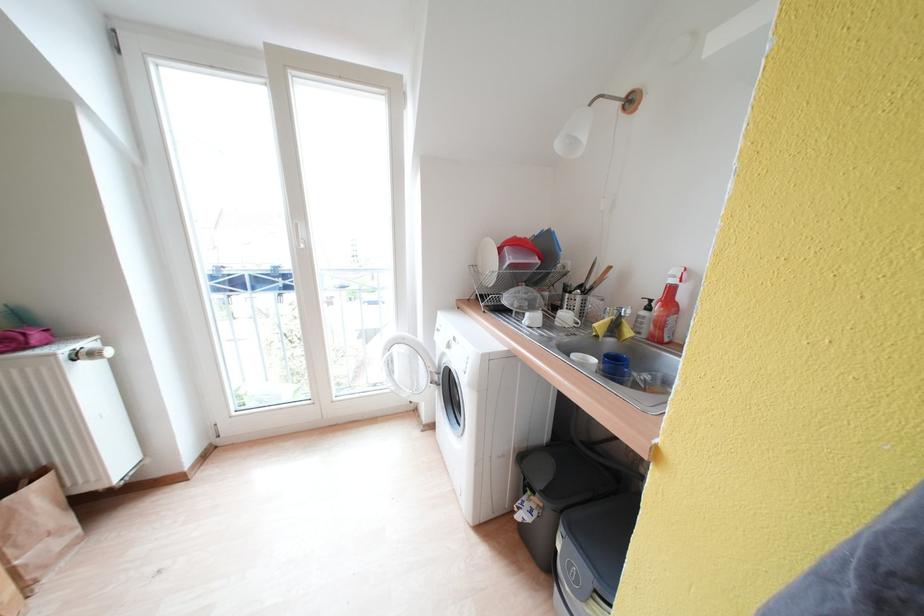
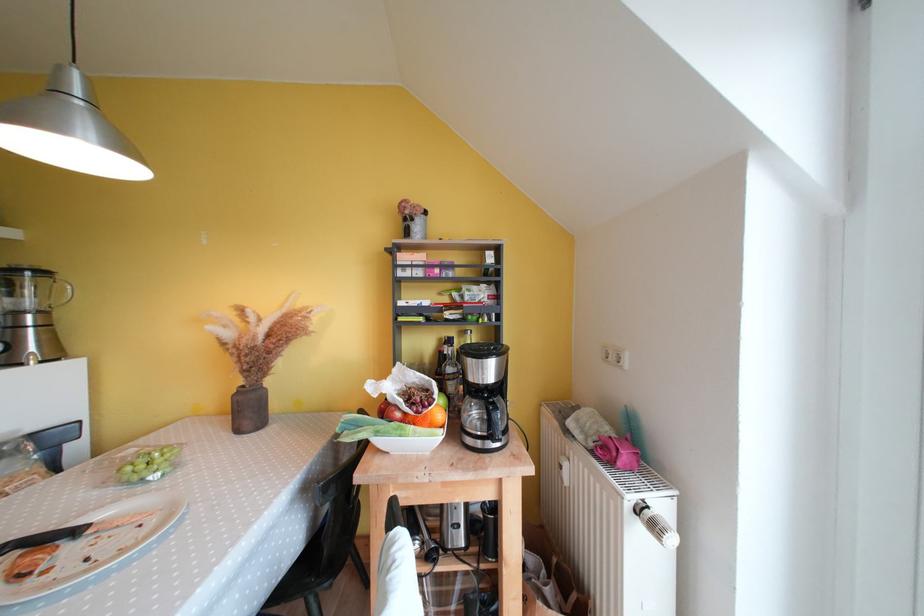
Where in the second image is the point corresponding to point 69,361 from the first image?

(634, 509)